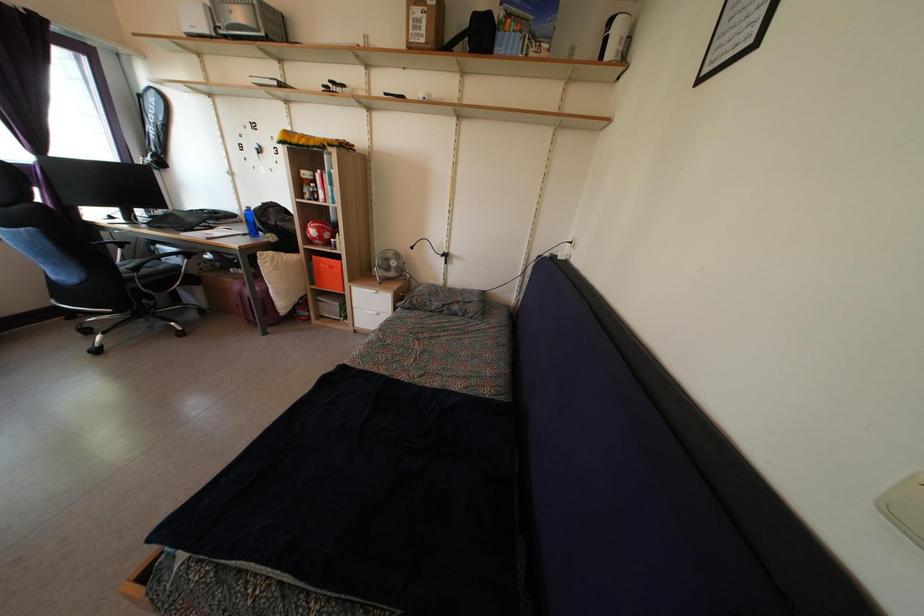
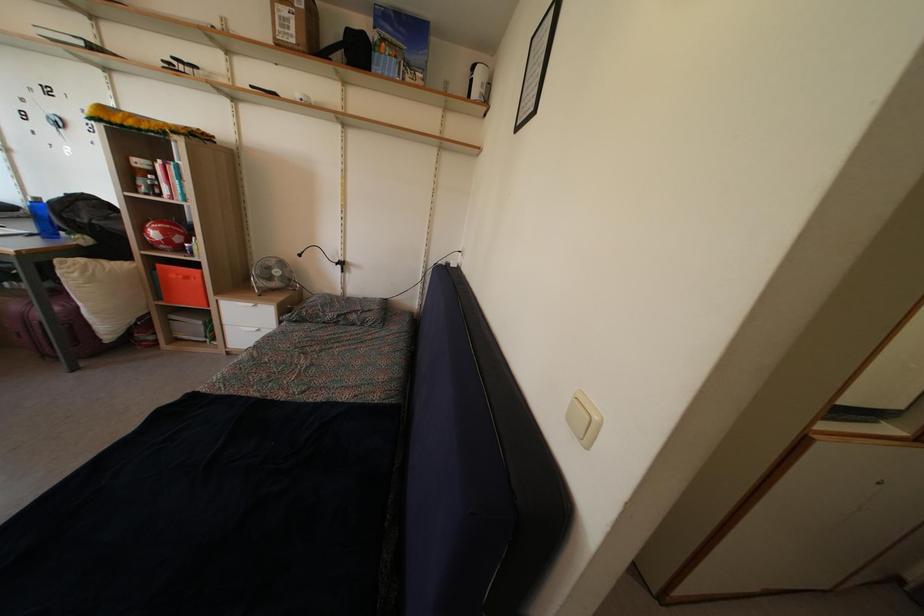
Where in the second image is the point corresponding to pixel 251 217 from the first image?

(40, 208)